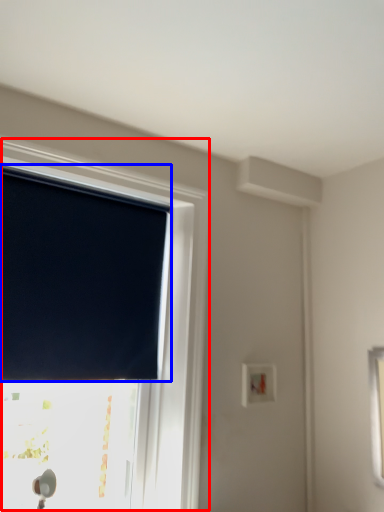
Question: Which object is closer to the camera taking this photo, window (highlighted by a red box) or window blind (highlighted by a blue box)?

Choices:
 (A) window
 (B) window blind

Answer: (A)